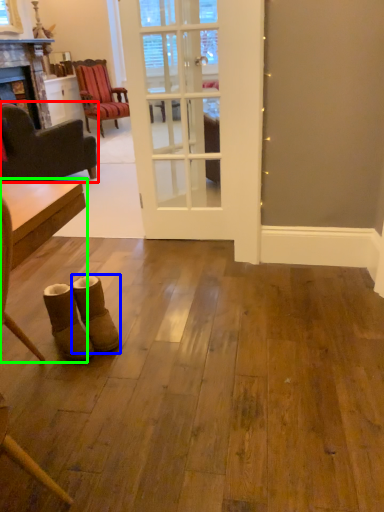
Question: Which is nearer to the chair (highlighted by a red box)? footwear (highlighted by a blue box) or table (highlighted by a green box).

Choices:
 (A) footwear
 (B) table

Answer: (A)